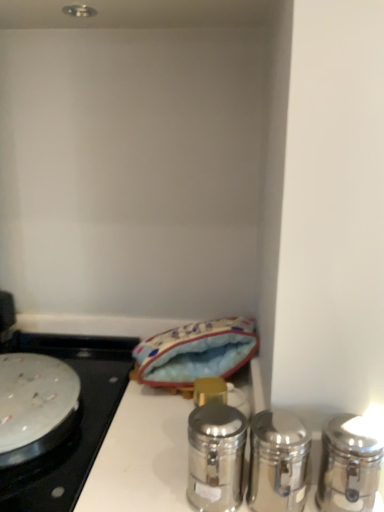
Find the location of a particular element. This screenshot has height=512, width=384. blue fabric pouch at center is located at coordinates pyautogui.click(x=196, y=352).

Describe the element at coordinates (348, 465) in the screenshot. I see `polished silver shaker at right, which ranks as the 1th salt and pepper shakers in right-to-left order` at that location.

Where is `silver metallic pan at left`? silver metallic pan at left is located at coordinates (75, 420).

Between point (87, 446) and point (204, 326), which one is positioned behind?

The point (204, 326) is more distant.

Can you tell me how much silver metallic pan at left and blue fabric pouch at center differ in facing direction?

They differ by 0.333 degrees in their facing directions.

Measure the distance between silver metallic pan at left and blue fabric pouch at center.

The distance of silver metallic pan at left from blue fabric pouch at center is 8.97 inches.

In the scene shown: From a real-world perspective, is silver metallic pan at left physically located above or below blue fabric pouch at center?

silver metallic pan at left is below blue fabric pouch at center.

Which is correct: polished silver shaker at center, which is the 1th salt and pepper shakers from left to right, is inside silver metallic pan at left, or outside of it?

polished silver shaker at center, which is the 1th salt and pepper shakers from left to right, lies outside silver metallic pan at left.

In the image, is polished silver shaker at center, which is the 1th salt and pepper shakers from left to right, on the left side or the right side of silver metallic pan at left?

From the image, it's evident that polished silver shaker at center, which is the 1th salt and pepper shakers from left to right, is to the right of silver metallic pan at left.

Is silver metallic pan at left at the back of polished silver shaker at center, which is the 1th salt and pepper shakers from left to right?

No, polished silver shaker at center, which is the 1th salt and pepper shakers from left to right,'s orientation is not away from silver metallic pan at left.

Is polished silver shaker at center, the 3th salt and pepper shakers viewed from the right, bigger or smaller than silver metallic pan at left?

polished silver shaker at center, the 3th salt and pepper shakers viewed from the right, is smaller than silver metallic pan at left.

Is blue fabric pouch at center facing away from polished silver shaker at right, the 2th salt and pepper shakers when ordered from left to right?

A: That's not correct — blue fabric pouch at center is not looking away from polished silver shaker at right, the 2th salt and pepper shakers when ordered from left to right.

Is polished silver shaker at right, the 2th salt and pepper shakers when ordered from left to right, located within blue fabric pouch at center?

No, polished silver shaker at right, the 2th salt and pepper shakers when ordered from left to right, is located outside of blue fabric pouch at center.

The height and width of the screenshot is (512, 384). I want to click on the 2nd salt and pepper shakers to the right when counting from the blue fabric pouch at center, so click(x=278, y=462).

Considering the sizes of objects polished silver shaker at right, positioned as the 3th salt and pepper shakers in left-to-right order, and polished silver shaker at right, positioned as the 2th salt and pepper shakers in right-to-left order, in the image provided, who is shorter, polished silver shaker at right, positioned as the 3th salt and pepper shakers in left-to-right order, or polished silver shaker at right, positioned as the 2th salt and pepper shakers in right-to-left order,?

polished silver shaker at right, positioned as the 2th salt and pepper shakers in right-to-left order.

Considering the relative sizes of polished silver shaker at right, positioned as the 3th salt and pepper shakers in left-to-right order, and polished silver shaker at right, the 2th salt and pepper shakers when ordered from left to right, in the image provided, is polished silver shaker at right, positioned as the 3th salt and pepper shakers in left-to-right order, thinner than polished silver shaker at right, the 2th salt and pepper shakers when ordered from left to right,?

Yes, polished silver shaker at right, positioned as the 3th salt and pepper shakers in left-to-right order, is thinner than polished silver shaker at right, the 2th salt and pepper shakers when ordered from left to right.

Based on the photo, from a real-world perspective, does polished silver shaker at right, which ranks as the 1th salt and pepper shakers in right-to-left order, sit lower than polished silver shaker at right, positioned as the 2th salt and pepper shakers in right-to-left order?

Yes, from a real-world perspective, polished silver shaker at right, which ranks as the 1th salt and pepper shakers in right-to-left order, is beneath polished silver shaker at right, positioned as the 2th salt and pepper shakers in right-to-left order.

How many degrees apart are the facing directions of polished silver shaker at right, which ranks as the 1th salt and pepper shakers in right-to-left order, and polished silver shaker at right, the 2th salt and pepper shakers when ordered from left to right?

polished silver shaker at right, which ranks as the 1th salt and pepper shakers in right-to-left order, and polished silver shaker at right, the 2th salt and pepper shakers when ordered from left to right, are facing 0.000255 degrees away from each other.

Considering the sizes of objects blue fabric pouch at center and polished silver shaker at center, the 3th salt and pepper shakers viewed from the right, in the image provided, who is wider, blue fabric pouch at center or polished silver shaker at center, the 3th salt and pepper shakers viewed from the right,?

With larger width is blue fabric pouch at center.

Is blue fabric pouch at center next to polished silver shaker at center, which is the 1th salt and pepper shakers from left to right, and touching it?

No, blue fabric pouch at center is not beside polished silver shaker at center, which is the 1th salt and pepper shakers from left to right.

Measure the distance between blue fabric pouch at center and polished silver shaker at center, which is the 1th salt and pepper shakers from left to right.

blue fabric pouch at center and polished silver shaker at center, which is the 1th salt and pepper shakers from left to right, are 30.37 centimeters apart from each other.

Visually, is blue fabric pouch at center positioned to the left or to the right of polished silver shaker at center, the 3th salt and pepper shakers viewed from the right?

In the image, blue fabric pouch at center appears on the left side of polished silver shaker at center, the 3th salt and pepper shakers viewed from the right.

From the image's perspective, would you say blue fabric pouch at center is shown under silver metallic pan at left?

Actually, blue fabric pouch at center appears above silver metallic pan at left in the image.

Who is smaller, blue fabric pouch at center or silver metallic pan at left?

With smaller size is silver metallic pan at left.

Identify the location of material that appears on the right of silver metallic pan at left. (196, 352).

From the image's perspective, which one is positioned higher, silver metallic pan at left or polished silver shaker at right, positioned as the 2th salt and pepper shakers in right-to-left order?

polished silver shaker at right, positioned as the 2th salt and pepper shakers in right-to-left order, from the image's perspective.

Is silver metallic pan at left wider than polished silver shaker at right, the 2th salt and pepper shakers when ordered from left to right?

Yes.

Relative to polished silver shaker at right, positioned as the 2th salt and pepper shakers in right-to-left order, is silver metallic pan at left in front or behind?

silver metallic pan at left is behind polished silver shaker at right, positioned as the 2th salt and pepper shakers in right-to-left order.

Considering the sizes of objects silver metallic pan at left and polished silver shaker at right, positioned as the 2th salt and pepper shakers in right-to-left order, in the image provided, who is smaller, silver metallic pan at left or polished silver shaker at right, positioned as the 2th salt and pepper shakers in right-to-left order,?

With smaller size is polished silver shaker at right, positioned as the 2th salt and pepper shakers in right-to-left order.

Where is `gas stove below the blue fabric pouch at center (from a real-world perspective)`? gas stove below the blue fabric pouch at center (from a real-world perspective) is located at coordinates (75, 420).

Locate an element on the screen. the 1st salt and pepper shakers counting from the right of the silver metallic pan at left is located at coordinates (216, 457).

When comparing their distances from polished silver shaker at center, which is the 1th salt and pepper shakers from left to right, does blue fabric pouch at center or polished silver shaker at right, positioned as the 2th salt and pepper shakers in right-to-left order, seem closer?

polished silver shaker at right, positioned as the 2th salt and pepper shakers in right-to-left order.

In the scene shown: Looking at the image, which one is located further to polished silver shaker at center, the 3th salt and pepper shakers viewed from the right, silver metallic pan at left or blue fabric pouch at center?

silver metallic pan at left is further to polished silver shaker at center, the 3th salt and pepper shakers viewed from the right.

Estimate the real-world distances between objects in this image. Which object is further from polished silver shaker at right, the 2th salt and pepper shakers when ordered from left to right, polished silver shaker at right, which ranks as the 1th salt and pepper shakers in right-to-left order, or blue fabric pouch at center?

The object further to polished silver shaker at right, the 2th salt and pepper shakers when ordered from left to right, is blue fabric pouch at center.

Based on their spatial positions, is silver metallic pan at left or polished silver shaker at right, which ranks as the 1th salt and pepper shakers in right-to-left order, closer to blue fabric pouch at center?

silver metallic pan at left is positioned closer to the anchor blue fabric pouch at center.

Based on their spatial positions, is blue fabric pouch at center or silver metallic pan at left further from polished silver shaker at center, the 3th salt and pepper shakers viewed from the right?

Among the two, silver metallic pan at left is located further to polished silver shaker at center, the 3th salt and pepper shakers viewed from the right.

Looking at the image, which one is located further to polished silver shaker at center, which is the 1th salt and pepper shakers from left to right, polished silver shaker at right, the 2th salt and pepper shakers when ordered from left to right, or polished silver shaker at right, which ranks as the 1th salt and pepper shakers in right-to-left order?

Among the two, polished silver shaker at right, which ranks as the 1th salt and pepper shakers in right-to-left order, is located further to polished silver shaker at center, which is the 1th salt and pepper shakers from left to right.

When comparing their distances from polished silver shaker at right, positioned as the 2th salt and pepper shakers in right-to-left order, does blue fabric pouch at center or silver metallic pan at left seem closer?

Based on the image, blue fabric pouch at center appears to be nearer to polished silver shaker at right, positioned as the 2th salt and pepper shakers in right-to-left order.

When comparing their distances from polished silver shaker at right, which ranks as the 1th salt and pepper shakers in right-to-left order, does silver metallic pan at left or polished silver shaker at center, the 3th salt and pepper shakers viewed from the right, seem closer?

polished silver shaker at center, the 3th salt and pepper shakers viewed from the right.

This screenshot has height=512, width=384. I want to click on material between silver metallic pan at left and polished silver shaker at center, the 3th salt and pepper shakers viewed from the right, from left to right, so click(x=196, y=352).

At what (x,y) coordinates should I click in order to perform the action: click on salt and pepper shakers between polished silver shaker at center, which is the 1th salt and pepper shakers from left to right, and polished silver shaker at right, which ranks as the 1th salt and pepper shakers in right-to-left order, from left to right. Please return your answer as a coordinate pair (x, y). Looking at the image, I should click on (278, 462).

The image size is (384, 512). I want to click on salt and pepper shakers between silver metallic pan at left and polished silver shaker at right, positioned as the 2th salt and pepper shakers in right-to-left order, so click(x=216, y=457).

You are a GUI agent. You are given a task and a screenshot of the screen. Output one action in this format:
    pyautogui.click(x=<x>, y=<y>)
    Task: Click on the material between silver metallic pan at left and polished silver shaker at right, positioned as the 2th salt and pepper shakers in right-to-left order
    The width and height of the screenshot is (384, 512).
    Given the screenshot: What is the action you would take?
    pyautogui.click(x=196, y=352)